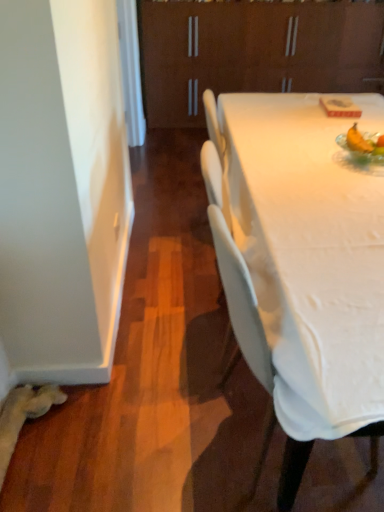
Question: Is the position of white plastic chair at center less distant than that of brown matte cabinet at upper center?

Choices:
 (A) no
 (B) yes

Answer: (B)

Question: Is white plastic chair at center far away from brown matte cabinet at upper center?

Choices:
 (A) yes
 (B) no

Answer: (A)

Question: From a real-world perspective, is white plastic chair at center over brown matte cabinet at upper center?

Choices:
 (A) no
 (B) yes

Answer: (A)

Question: Is white plastic chair at center positioned with its back to brown matte cabinet at upper center?

Choices:
 (A) no
 (B) yes

Answer: (A)

Question: Can you see white plastic chair at center touching brown matte cabinet at upper center?

Choices:
 (A) yes
 (B) no

Answer: (B)

Question: Considering the positions of white plastic chair at center and translucent glass bowl at upper right in the image, is white plastic chair at center bigger or smaller than translucent glass bowl at upper right?

Choices:
 (A) small
 (B) big

Answer: (B)

Question: Considering the positions of white plastic chair at center and translucent glass bowl at upper right in the image, is white plastic chair at center taller or shorter than translucent glass bowl at upper right?

Choices:
 (A) short
 (B) tall

Answer: (B)

Question: From the image's perspective, relative to translucent glass bowl at upper right, is white plastic chair at center above or below?

Choices:
 (A) above
 (B) below

Answer: (B)

Question: Relative to translucent glass bowl at upper right, is white plastic chair at center in front or behind?

Choices:
 (A) behind
 (B) front

Answer: (B)

Question: Considering the positions of white plastic chair at center and brown matte cabinet at upper center in the image, is white plastic chair at center taller or shorter than brown matte cabinet at upper center?

Choices:
 (A) tall
 (B) short

Answer: (B)

Question: Considering the relative positions of white plastic chair at center and brown matte cabinet at upper center in the image provided, is white plastic chair at center to the left or to the right of brown matte cabinet at upper center?

Choices:
 (A) right
 (B) left

Answer: (B)

Question: Based on their sizes in the image, would you say white plastic chair at center is bigger or smaller than brown matte cabinet at upper center?

Choices:
 (A) big
 (B) small

Answer: (B)

Question: Is white plastic chair at center in front of or behind brown matte cabinet at upper center in the image?

Choices:
 (A) behind
 (B) front

Answer: (B)

Question: Does point (332, 37) appear closer or farther from the camera than point (349, 145)?

Choices:
 (A) closer
 (B) farther

Answer: (B)

Question: Visually, is brown matte cabinet at upper center positioned to the left or to the right of translucent glass bowl at upper right?

Choices:
 (A) left
 (B) right

Answer: (B)